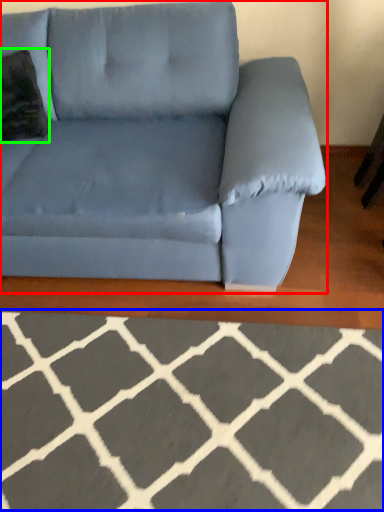
Question: Which is nearer to the studio couch (highlighted by a red box)? furniture (highlighted by a blue box) or throw pillow (highlighted by a green box).

Choices:
 (A) furniture
 (B) throw pillow

Answer: (B)